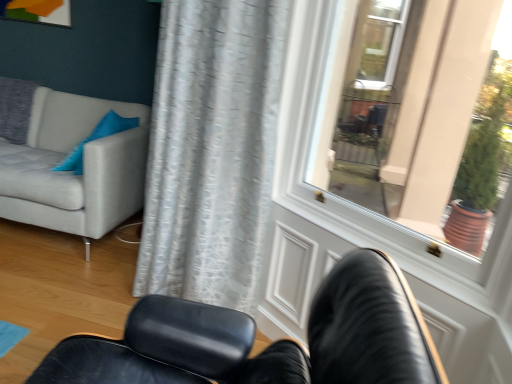
Question: Is white glossy door at upper right at the right side of black leather chair at lower center?

Choices:
 (A) no
 (B) yes

Answer: (B)

Question: Is white glossy door at upper right positioned with its back to black leather chair at lower center?

Choices:
 (A) yes
 (B) no

Answer: (B)

Question: Considering the relative sizes of white glossy door at upper right and black leather chair at lower center in the image provided, is white glossy door at upper right bigger than black leather chair at lower center?

Choices:
 (A) no
 (B) yes

Answer: (A)

Question: Is white glossy door at upper right taller than black leather chair at lower center?

Choices:
 (A) yes
 (B) no

Answer: (A)

Question: Considering the relative positions of white glossy door at upper right and black leather chair at lower center in the image provided, is white glossy door at upper right to the left of black leather chair at lower center from the viewer's perspective?

Choices:
 (A) no
 (B) yes

Answer: (A)

Question: Relative to light gray fabric couch at left, is black leather chair at lower center in front or behind?

Choices:
 (A) behind
 (B) front

Answer: (B)

Question: Considering the positions of point (259, 354) and point (40, 144), is point (259, 354) closer or farther from the camera than point (40, 144)?

Choices:
 (A) farther
 (B) closer

Answer: (B)

Question: Which is correct: black leather chair at lower center is inside light gray fabric couch at left, or outside of it?

Choices:
 (A) outside
 (B) inside

Answer: (A)

Question: From a real-world perspective, relative to light gray fabric couch at left, is black leather chair at lower center vertically above or below?

Choices:
 (A) above
 (B) below

Answer: (A)

Question: Is blue fabric pillow at upper left bigger or smaller than white glossy door at upper right?

Choices:
 (A) big
 (B) small

Answer: (B)

Question: Is blue fabric pillow at upper left in front of or behind white glossy door at upper right in the image?

Choices:
 (A) front
 (B) behind

Answer: (B)

Question: From the image's perspective, is blue fabric pillow at upper left positioned above or below white glossy door at upper right?

Choices:
 (A) below
 (B) above

Answer: (B)

Question: Considering the relative positions of blue fabric pillow at upper left and white glossy door at upper right in the image provided, is blue fabric pillow at upper left to the left or to the right of white glossy door at upper right?

Choices:
 (A) left
 (B) right

Answer: (A)

Question: Is point (317, 51) positioned closer to the camera than point (4, 158)?

Choices:
 (A) closer
 (B) farther

Answer: (A)

Question: From the image's perspective, is white glossy door at upper right located above or below light gray fabric couch at left?

Choices:
 (A) above
 (B) below

Answer: (B)